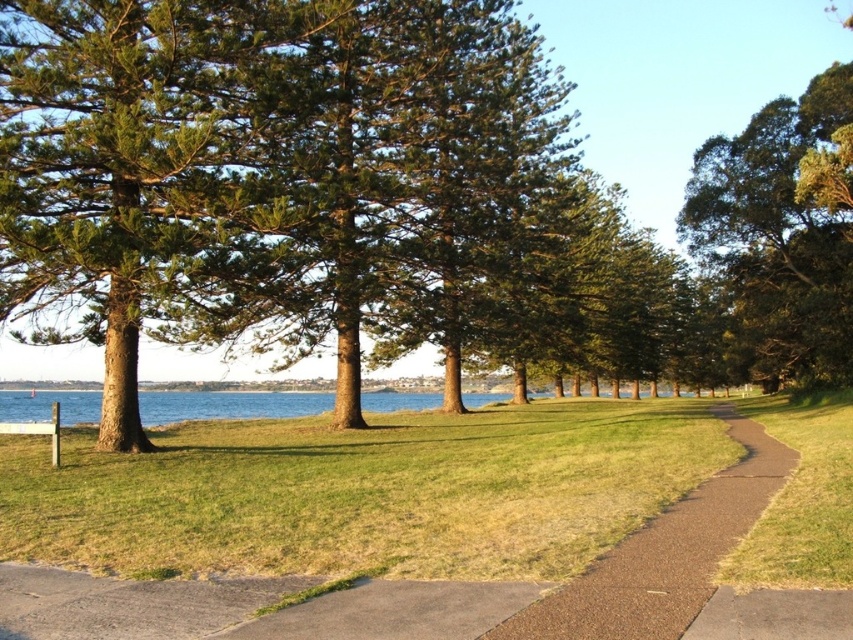
You are a gardener planning to plant a new tree in the grassy area between the green textured pine tree at center and the brown asphalt path at center. If the new tree requires a planting space that is narrower than the existing pine tree, will there be enough space between them?

The green textured pine tree at center might be wider than the brown asphalt path at center, so the space between them may not be sufficient for a new tree requiring narrower space than the pine tree. Check the actual width before planting.

You are a hiker standing at the start of the brown asphalt path at center. You want to reach the green textured pine tree at center. Is the tree blocking your path? Explain why.

The green textured pine tree at center is positioned over the brown asphalt path at center, so it is blocking your path.